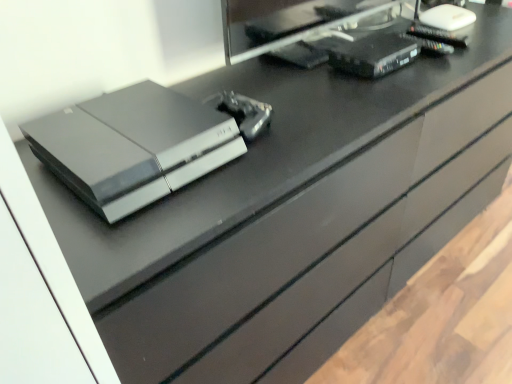
In order to face black plastic desktop computer at upper right, should I rotate leftwards or rightwards?

To face it directly, rotate right by 12.904 degrees.

This screenshot has height=384, width=512. Describe the element at coordinates (374, 55) in the screenshot. I see `black plastic router at upper right, which is the first equipment from top to bottom` at that location.

This screenshot has width=512, height=384. Find the location of `metallic silver controller at center, the 2th equipment when ordered from top to bottom`. metallic silver controller at center, the 2th equipment when ordered from top to bottom is located at coordinates (243, 112).

Locate an element on the screen. The height and width of the screenshot is (384, 512). black plastic desktop computer at upper right is located at coordinates (308, 33).

From the image's perspective, is black plastic router at upper right, the first equipment viewed from the right, above or below metallic silver controller at center, which is the 1th equipment in bottom-to-top order?

Based on their image positions, black plastic router at upper right, the first equipment viewed from the right, is located above metallic silver controller at center, which is the 1th equipment in bottom-to-top order.

Where is `equipment on the left of black plastic router at upper right, which ranks as the second equipment in front-to-back order`? equipment on the left of black plastic router at upper right, which ranks as the second equipment in front-to-back order is located at coordinates (243, 112).

Considering the positions of objects black plastic router at upper right, which ranks as the second equipment in front-to-back order, and metallic silver controller at center, the 2th equipment viewed from the back, in the image provided, who is behind, black plastic router at upper right, which ranks as the second equipment in front-to-back order, or metallic silver controller at center, the 2th equipment viewed from the back,?

black plastic router at upper right, which ranks as the second equipment in front-to-back order, is more distant.

From the image's perspective, who appears lower, black plastic desktop computer at upper right or metallic silver controller at center, the 2th equipment viewed from the back?

metallic silver controller at center, the 2th equipment viewed from the back, appears lower in the image.

Is the position of black plastic desktop computer at upper right less distant than that of metallic silver controller at center, which is the 1th equipment in left-to-right order?

No, it is behind metallic silver controller at center, which is the 1th equipment in left-to-right order.

Who is bigger, black plastic desktop computer at upper right or metallic silver controller at center, which is counted as the first equipment, starting from the front?

black plastic desktop computer at upper right is bigger.

Which object is wider, black plastic desktop computer at upper right or metallic silver controller at center, which is the 1th equipment in bottom-to-top order?

metallic silver controller at center, which is the 1th equipment in bottom-to-top order, is wider.

Is satin black console at center bigger than black plastic router at upper right, which is the first equipment from top to bottom?

Yes.

Is satin black console at center turned away from black plastic router at upper right, which ranks as the second equipment in front-to-back order?

No, black plastic router at upper right, which ranks as the second equipment in front-to-back order, is not at the back of satin black console at center.

Which object is wider, satin black console at center or black plastic router at upper right, positioned as the 1th equipment in back-to-front order?

With larger width is satin black console at center.

The width and height of the screenshot is (512, 384). What are the coordinates of `the 2nd equipment behind when counting from the satin black console at center` in the screenshot? It's located at coord(374,55).

Considering the sizes of objects black plastic router at upper right, the first equipment viewed from the right, and satin black console at center in the image provided, who is shorter, black plastic router at upper right, the first equipment viewed from the right, or satin black console at center?

Standing shorter between the two is black plastic router at upper right, the first equipment viewed from the right.

Is black plastic router at upper right, which is the first equipment from top to bottom, to the left of satin black console at center from the viewer's perspective?

No, black plastic router at upper right, which is the first equipment from top to bottom, is not to the left of satin black console at center.

Is black plastic router at upper right, which ranks as the second equipment in front-to-back order, wider or thinner than satin black console at center?

Considering their sizes, black plastic router at upper right, which ranks as the second equipment in front-to-back order, looks slimmer than satin black console at center.

Identify the location of equipment that is the 1st one below the black plastic desktop computer at upper right (from a real-world perspective). [374, 55].

Is black plastic desktop computer at upper right further to the viewer compared to black plastic router at upper right, the first equipment viewed from the right?

No, the depth of black plastic desktop computer at upper right is less than that of black plastic router at upper right, the first equipment viewed from the right.

Can you tell me how much metallic silver controller at center, which is the 1th equipment in left-to-right order, and black plastic desktop computer at upper right differ in facing direction?

They differ by 1.45 degrees in their facing directions.

Are metallic silver controller at center, the second equipment from the right, and black plastic desktop computer at upper right beside each other?

No, metallic silver controller at center, the second equipment from the right, is not making contact with black plastic desktop computer at upper right.

Could you measure the distance between metallic silver controller at center, the 2th equipment viewed from the back, and black plastic desktop computer at upper right?

metallic silver controller at center, the 2th equipment viewed from the back, and black plastic desktop computer at upper right are 12.97 inches apart from each other.

Is point (234, 101) more distant than point (302, 36)?

That is False.

Does point (75, 179) come behind point (228, 103)?

No, it is in front of (228, 103).

Is satin black console at center inside or outside of metallic silver controller at center, the 2th equipment viewed from the back?

satin black console at center is outside metallic silver controller at center, the 2th equipment viewed from the back.

In terms of width, does satin black console at center look wider or thinner when compared to metallic silver controller at center, which is the 1th equipment in left-to-right order?

In the image, satin black console at center appears to be wider than metallic silver controller at center, which is the 1th equipment in left-to-right order.

You are a GUI agent. You are given a task and a screenshot of the screen. Output one action in this format:
    pyautogui.click(x=<x>, y=<y>)
    Task: Click on the 1st equipment counting from the right side of the satin black console at center
    
    Given the screenshot: What is the action you would take?
    click(x=243, y=112)

Where is `equipment below the black plastic router at upper right, positioned as the 1th equipment in back-to-front order (from the image's perspective)`? The width and height of the screenshot is (512, 384). equipment below the black plastic router at upper right, positioned as the 1th equipment in back-to-front order (from the image's perspective) is located at coordinates (243, 112).

This screenshot has width=512, height=384. In order to click on desktop computer behind the metallic silver controller at center, which is counted as the first equipment, starting from the front in this screenshot , I will do `click(308, 33)`.

Based on their spatial positions, is black plastic router at upper right, the 2th equipment when ordered from bottom to top, or metallic silver controller at center, which is counted as the first equipment, starting from the front, further from satin black console at center?

Based on the image, black plastic router at upper right, the 2th equipment when ordered from bottom to top, appears to be further to satin black console at center.

Looking at the image, which one is located further to black plastic router at upper right, which ranks as the 2th equipment in left-to-right order, metallic silver controller at center, which is the 1th equipment in bottom-to-top order, or satin black console at center?

satin black console at center lies further to black plastic router at upper right, which ranks as the 2th equipment in left-to-right order, than the other object.

Looking at the image, which one is located closer to black plastic router at upper right, the 2th equipment when ordered from bottom to top, satin black console at center or metallic silver controller at center, which is the 1th equipment in left-to-right order?

metallic silver controller at center, which is the 1th equipment in left-to-right order, lies closer to black plastic router at upper right, the 2th equipment when ordered from bottom to top, than the other object.

From the picture: When comparing their distances from satin black console at center, does metallic silver controller at center, the 2th equipment viewed from the back, or black plastic desktop computer at upper right seem further?

black plastic desktop computer at upper right.

Estimate the real-world distances between objects in this image. Which object is closer to metallic silver controller at center, the 2th equipment viewed from the back, black plastic desktop computer at upper right or satin black console at center?

satin black console at center lies closer to metallic silver controller at center, the 2th equipment viewed from the back, than the other object.

Which object lies nearer to the anchor point black plastic desktop computer at upper right, black plastic router at upper right, the 2th equipment when ordered from bottom to top, or satin black console at center?

The object closer to black plastic desktop computer at upper right is black plastic router at upper right, the 2th equipment when ordered from bottom to top.

Estimate the real-world distances between objects in this image. Which object is further from black plastic desktop computer at upper right, satin black console at center or black plastic router at upper right, which ranks as the 2th equipment in left-to-right order?

satin black console at center.

Considering their positions, is metallic silver controller at center, the 2th equipment viewed from the back, positioned further to black plastic desktop computer at upper right than black plastic router at upper right, the 2th equipment when ordered from bottom to top?

The object further to black plastic desktop computer at upper right is metallic silver controller at center, the 2th equipment viewed from the back.

You are a GUI agent. You are given a task and a screenshot of the screen. Output one action in this format:
    pyautogui.click(x=<x>, y=<y>)
    Task: Click on the equipment located between satin black console at center and black plastic router at upper right, positioned as the 1th equipment in back-to-front order, in the left-right direction
    This screenshot has height=384, width=512.
    Given the screenshot: What is the action you would take?
    pyautogui.click(x=243, y=112)

Locate an element on the screen. Image resolution: width=512 pixels, height=384 pixels. equipment situated between satin black console at center and black plastic desktop computer at upper right from left to right is located at coordinates tap(243, 112).

Find the location of a particular element. Image resolution: width=512 pixels, height=384 pixels. desktop computer between metallic silver controller at center, the 2th equipment when ordered from top to bottom, and black plastic router at upper right, which ranks as the second equipment in front-to-back order is located at coordinates (308, 33).

Identify the location of desktop computer between satin black console at center and black plastic router at upper right, which ranks as the 2th equipment in left-to-right order, in the horizontal direction. (308, 33).